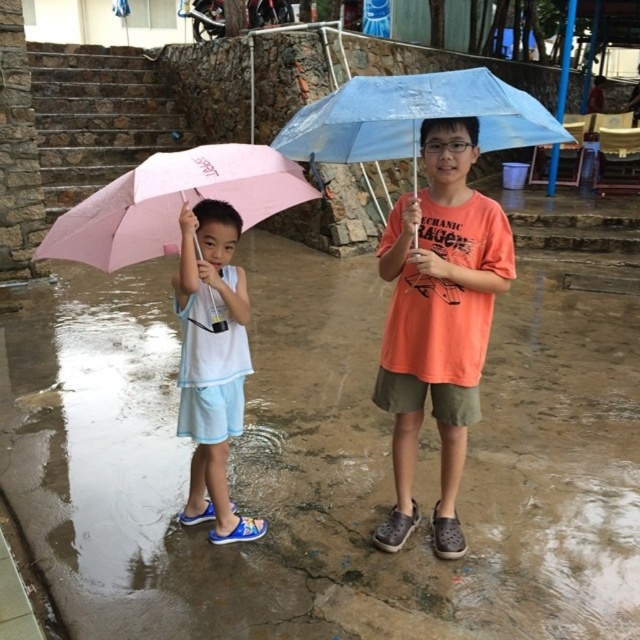
Question: Can you confirm if pink fabric umbrella at left is thinner than white matte shirt at left?

Choices:
 (A) no
 (B) yes

Answer: (A)

Question: Which is farther from the transparent blue umbrella at center?

Choices:
 (A) pink fabric umbrella at left
 (B) orange matte t-shirt at center

Answer: (A)

Question: Which object is farther from the camera taking this photo?

Choices:
 (A) pink fabric umbrella at left
 (B) white matte shirt at left
 (C) pink matte umbrella at left
 (D) orange matte t-shirt at center

Answer: (B)

Question: From the image, what is the correct spatial relationship of pink fabric umbrella at left in relation to transparent blue umbrella at center?

Choices:
 (A) below
 (B) above

Answer: (A)

Question: Is orange matte t-shirt at center bigger than white matte shirt at left?

Choices:
 (A) yes
 (B) no

Answer: (A)

Question: Which of the following is the farthest from the observer?

Choices:
 (A) white matte shirt at left
 (B) pink fabric umbrella at left

Answer: (A)